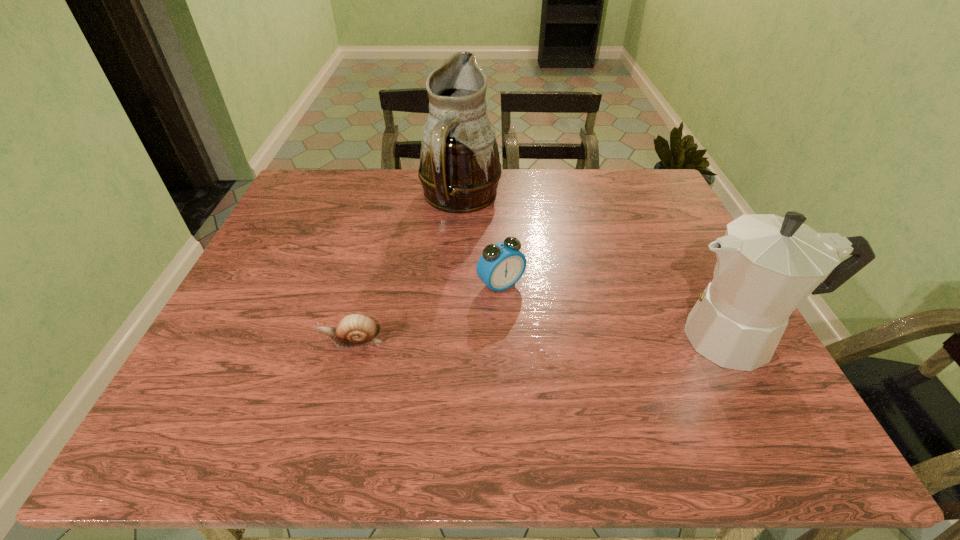
At what (x,y) coordinates should I click in order to perform the action: click on object that is at the far edge. Please return your answer as a coordinate pair (x, y). Looking at the image, I should click on (459, 170).

Where is `object located in the near edge section of the desktop`? Image resolution: width=960 pixels, height=540 pixels. object located in the near edge section of the desktop is located at coordinates (767, 265).

Identify the location of object that is at the right edge. (767, 265).

Identify the location of object located at the near right corner. Image resolution: width=960 pixels, height=540 pixels. (767, 265).

Identify the location of vacant space at the far edge. The image size is (960, 540). (519, 174).

In the image, there is a desktop. At what (x,y) coordinates should I click in order to perform the action: click on free space at the near edge. Please return your answer as a coordinate pair (x, y). The image size is (960, 540). Looking at the image, I should click on (509, 394).

Locate an element on the screen. free space at the left edge is located at coordinates coord(296,251).

The width and height of the screenshot is (960, 540). I want to click on blank space at the right edge of the desktop, so click(x=671, y=247).

Identify the location of vacant space at the far left corner of the desktop. The width and height of the screenshot is (960, 540). (332, 181).

At what (x,y) coordinates should I click in order to perform the action: click on free space at the near left corner. Please return your answer as a coordinate pair (x, y). Looking at the image, I should click on (247, 387).